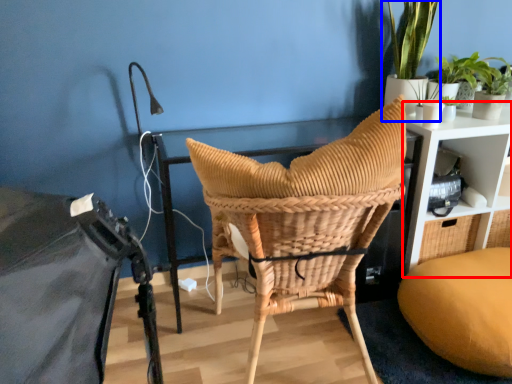
Question: Which object appears farthest to the camera in this image, shelf (highlighted by a red box) or houseplant (highlighted by a blue box)?

Choices:
 (A) shelf
 (B) houseplant

Answer: (A)